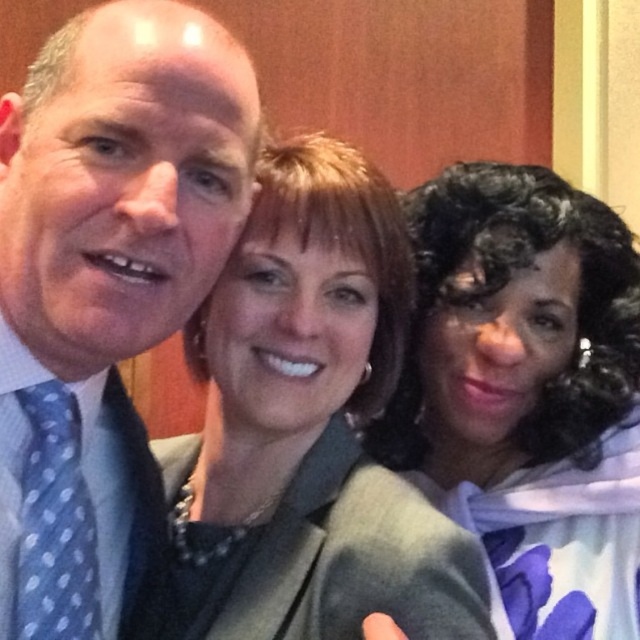
Is point (404, 536) farther from viewer compared to point (257, 586)?

No, it is not.

Between point (376, 579) and point (470, 561), which one is positioned behind?

The point (470, 561) is more distant.

This screenshot has width=640, height=640. Find the location of `matte gray blazer at center`. matte gray blazer at center is located at coordinates (312, 422).

Is blue dotted tie at left wider than blue polka dot tie at left?

Yes.

Between blue dotted tie at left and blue polka dot tie at left, which one appears on the left side from the viewer's perspective?

blue polka dot tie at left is more to the left.

Is point (122, 225) closer to viewer compared to point (118, 413)?

Yes, it is in front of point (118, 413).

Locate an element on the screen. blue dotted tie at left is located at coordinates (106, 296).

Consider the image. Is green wool blazer at center bigger than blue polka dot tie at left?

Correct, green wool blazer at center is larger in size than blue polka dot tie at left.

Identify the location of green wool blazer at center. This screenshot has width=640, height=640. (337, 561).

Which is in front, point (296, 561) or point (148, 572)?

Point (296, 561)

Where is `green wool blazer at center`? This screenshot has width=640, height=640. green wool blazer at center is located at coordinates (337, 561).